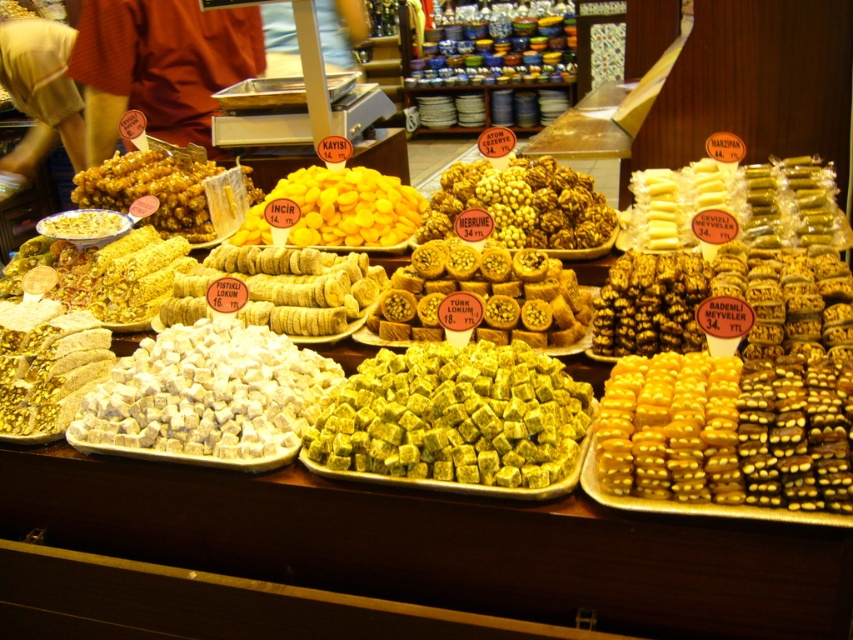
Question: Is green textured turkish delight at center above white soft candy at center?

Choices:
 (A) no
 (B) yes

Answer: (A)

Question: Does yellow crumbly pastry at center appear on the left side of golden crunchy pastry at center?

Choices:
 (A) yes
 (B) no

Answer: (B)

Question: Which point is farther from the camera taking this photo?

Choices:
 (A) (195, 179)
 (B) (393, 214)

Answer: (A)

Question: Which point appears closest to the camera in this image?

Choices:
 (A) (300, 212)
 (B) (287, 305)

Answer: (B)

Question: Which point appears closest to the camera in this image?

Choices:
 (A) (160, 220)
 (B) (408, 308)

Answer: (B)

Question: Is yellow crumbly pastry at center further to camera compared to white sugary candy at center?

Choices:
 (A) yes
 (B) no

Answer: (A)